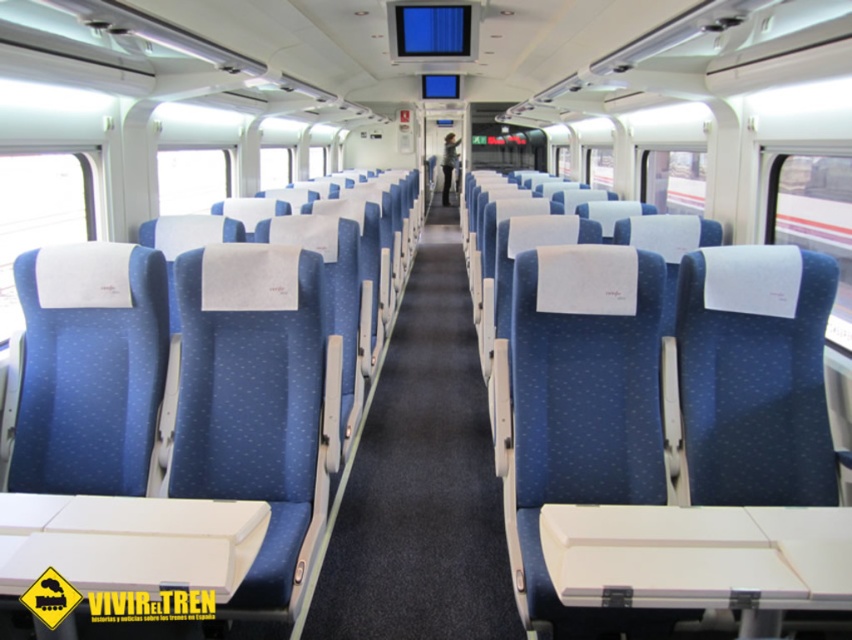
Can you confirm if blue fabric aisle at center is shorter than blue fabric coach at center?

Indeed, blue fabric aisle at center has a lesser height compared to blue fabric coach at center.

Is point (343, 616) closer to camera compared to point (444, 147)?

Yes, it is.

Where is `blue fabric aisle at center`? blue fabric aisle at center is located at coordinates (421, 481).